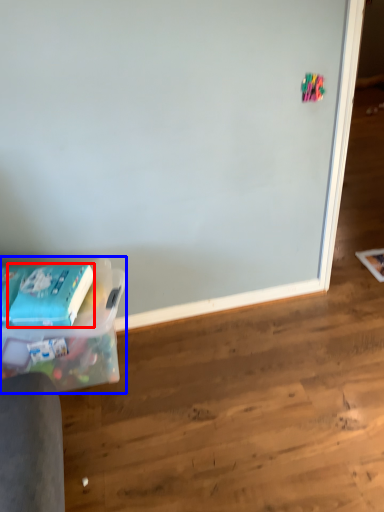
Question: Among these objects, which one is farthest to the camera, paperback book (highlighted by a red box) or box (highlighted by a blue box)?

Choices:
 (A) paperback book
 (B) box

Answer: (A)